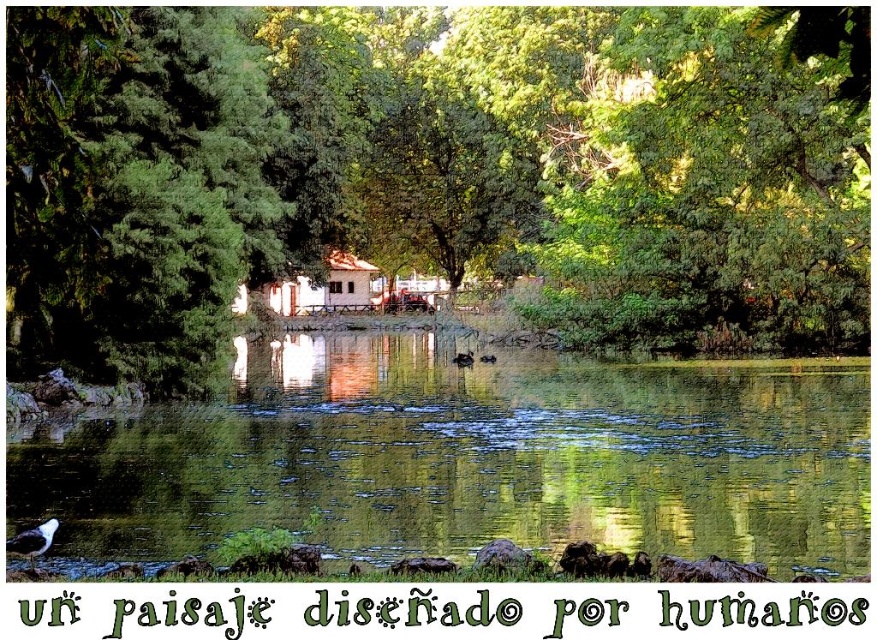
Based on the photo, between green reflective water at center and white wooden hut at center, which one is positioned higher?

white wooden hut at center is above.

Is green reflective water at center bigger than white wooden hut at center?

Yes, green reflective water at center is bigger than white wooden hut at center.

Where is `green reflective water at center`? This screenshot has width=877, height=640. green reflective water at center is located at coordinates (464, 458).

Can you confirm if green leafy tree at center is positioned to the left of green reflective water at center?

No, green leafy tree at center is not to the left of green reflective water at center.

Who is positioned more to the left, green leafy tree at center or green reflective water at center?

green reflective water at center is more to the left.

Does point (633, 216) come behind point (381, 355)?

No, (633, 216) is closer to viewer.

Image resolution: width=877 pixels, height=640 pixels. In order to click on green leafy tree at center in this screenshot , I will do `click(404, 163)`.

Between green leafy tree at center and white wooden hut at center, which one is positioned lower?

white wooden hut at center is lower down.

Which of these two, green leafy tree at center or white wooden hut at center, stands taller?

green leafy tree at center is taller.

What do you see at coordinates (404, 163) in the screenshot? The width and height of the screenshot is (877, 640). I see `green leafy tree at center` at bounding box center [404, 163].

Identify the location of green leafy tree at center. This screenshot has height=640, width=877. (404, 163).